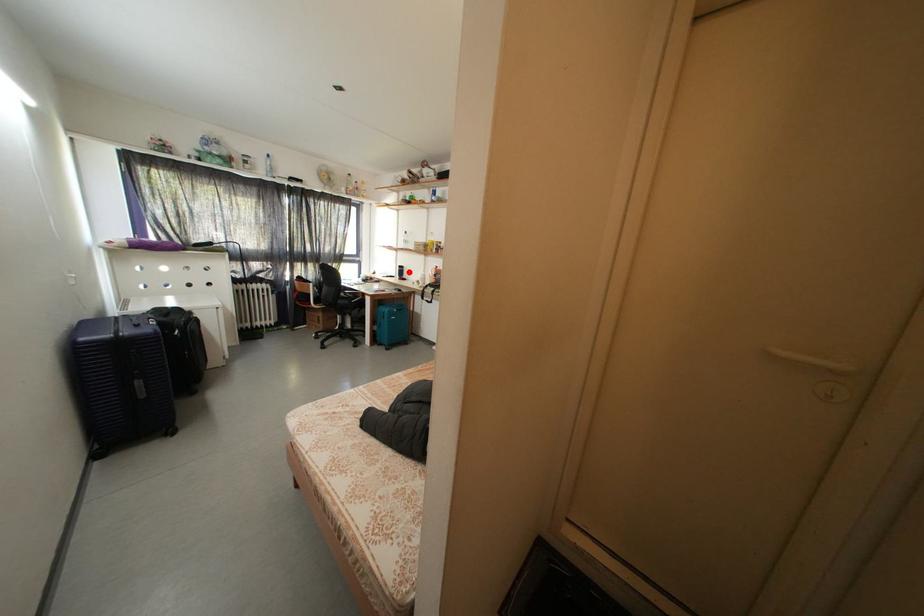
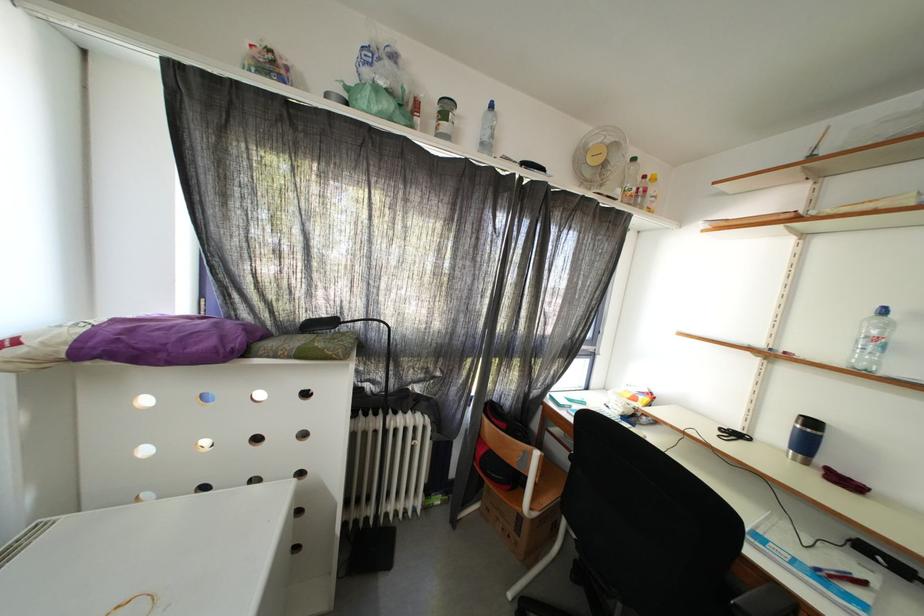
Find the pixel in the second image that matches the highlighted location in the first image.

(820, 429)